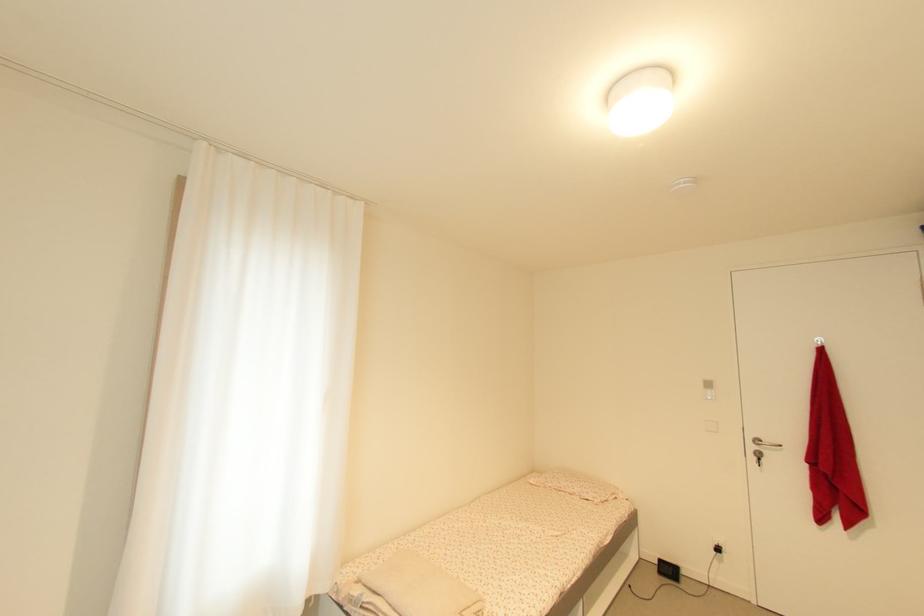
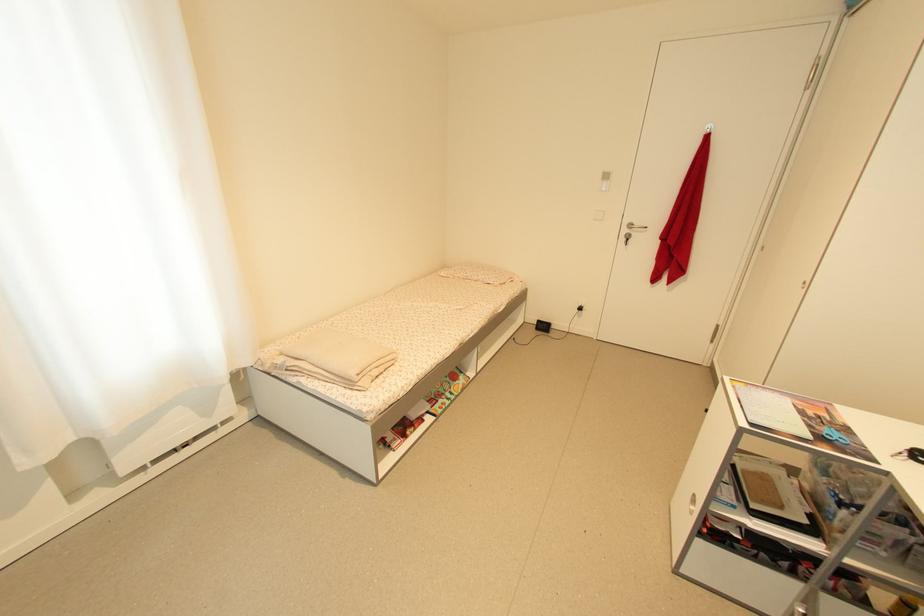
Where in the second image is the point corresponding to the point at 581,495 from the first image?

(485, 282)